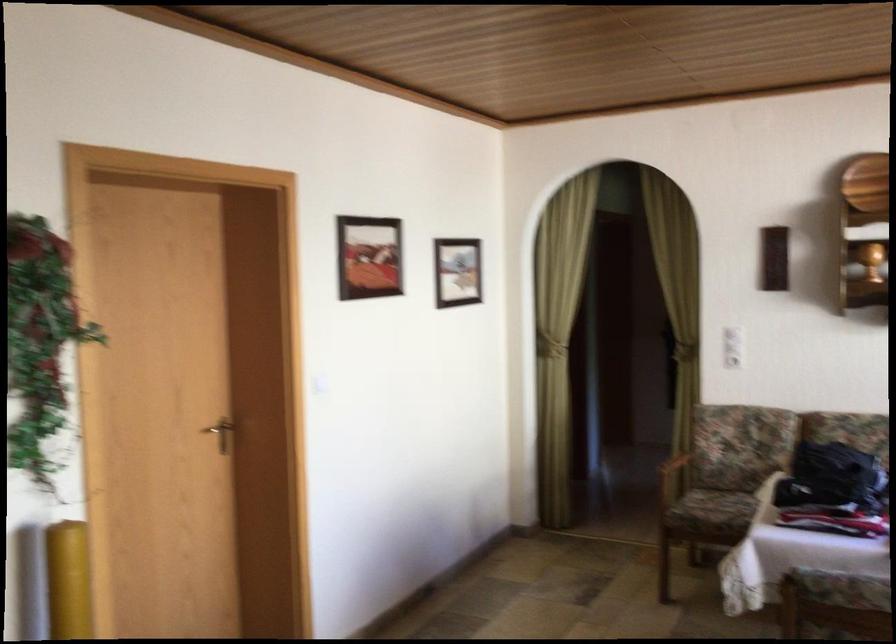
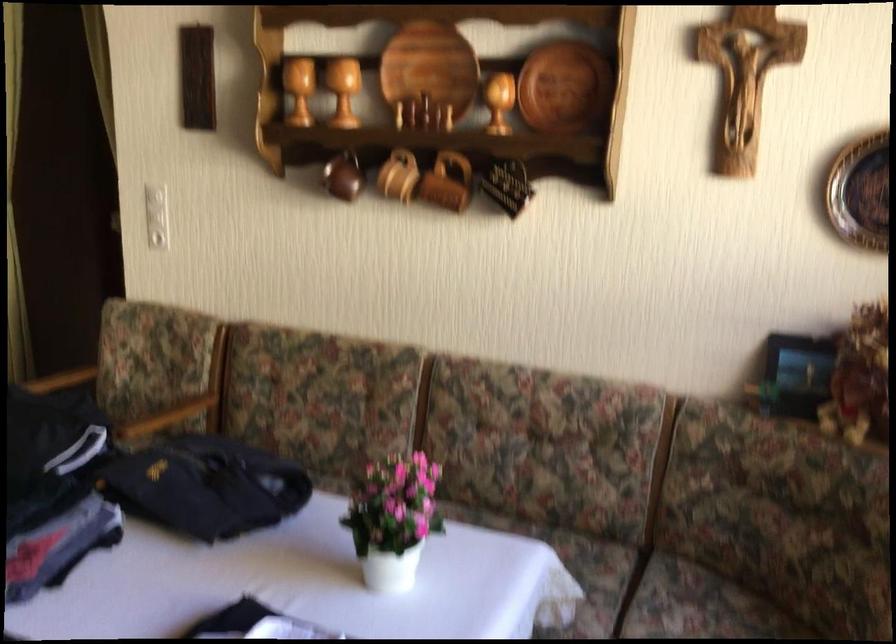
In a continuous first-person perspective shot, in which direction is the camera moving?

The cameraman moved toward right, forward.